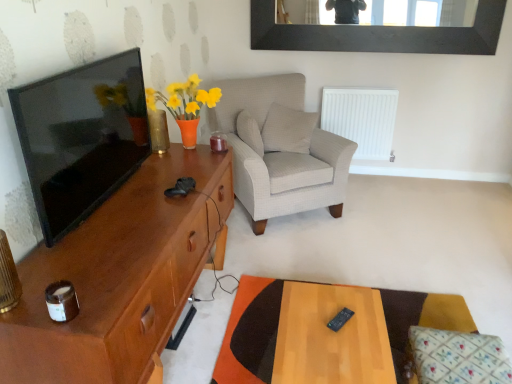
Where is `vacant region in front of matte black tv at left`? The height and width of the screenshot is (384, 512). vacant region in front of matte black tv at left is located at coordinates (113, 240).